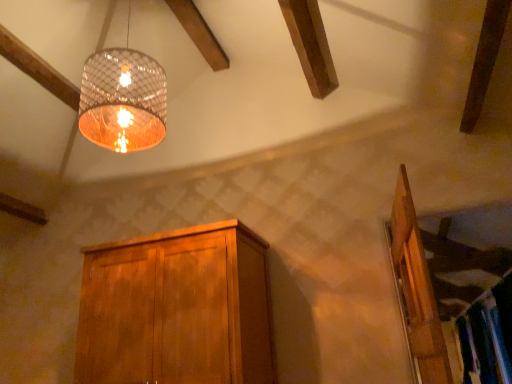
Question: Is wooden door at right looking in the opposite direction of translucent glass lampshade at upper center?

Choices:
 (A) yes
 (B) no

Answer: (B)

Question: Could you tell me if wooden door at right is facing translucent glass lampshade at upper center?

Choices:
 (A) no
 (B) yes

Answer: (A)

Question: Is wooden door at right at the right side of translucent glass lampshade at upper center?

Choices:
 (A) yes
 (B) no

Answer: (A)

Question: Is wooden door at right wider than translucent glass lampshade at upper center?

Choices:
 (A) yes
 (B) no

Answer: (B)

Question: Is wooden door at right not close to translucent glass lampshade at upper center?

Choices:
 (A) yes
 (B) no

Answer: (A)

Question: From the image's perspective, is wooden cabinet at center positioned above or below wooden door at right?

Choices:
 (A) below
 (B) above

Answer: (A)

Question: From a real-world perspective, is wooden cabinet at center physically located above or below wooden door at right?

Choices:
 (A) below
 (B) above

Answer: (B)

Question: Visually, is wooden cabinet at center positioned to the left or to the right of wooden door at right?

Choices:
 (A) left
 (B) right

Answer: (A)

Question: In the image, is wooden cabinet at center positioned in front of or behind wooden door at right?

Choices:
 (A) front
 (B) behind

Answer: (B)

Question: Considering the positions of translucent glass lampshade at upper center and wooden door at right in the image, is translucent glass lampshade at upper center taller or shorter than wooden door at right?

Choices:
 (A) short
 (B) tall

Answer: (B)

Question: Considering their positions, is translucent glass lampshade at upper center located in front of or behind wooden door at right?

Choices:
 (A) front
 (B) behind

Answer: (B)

Question: Is translucent glass lampshade at upper center situated inside wooden door at right or outside?

Choices:
 (A) outside
 (B) inside

Answer: (A)

Question: From a real-world perspective, is translucent glass lampshade at upper center above or below wooden door at right?

Choices:
 (A) above
 (B) below

Answer: (A)

Question: Considering the positions of wooden cabinet at center and translucent glass lampshade at upper center in the image, is wooden cabinet at center bigger or smaller than translucent glass lampshade at upper center?

Choices:
 (A) big
 (B) small

Answer: (A)

Question: Is wooden cabinet at center inside the boundaries of translucent glass lampshade at upper center, or outside?

Choices:
 (A) outside
 (B) inside

Answer: (A)